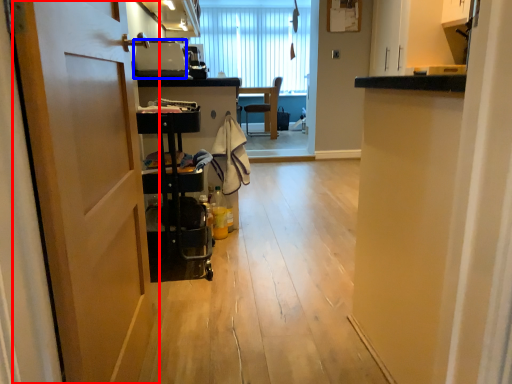
Question: Among these objects, which one is farthest to the camera, door (highlighted by a red box) or appliance (highlighted by a blue box)?

Choices:
 (A) door
 (B) appliance

Answer: (B)